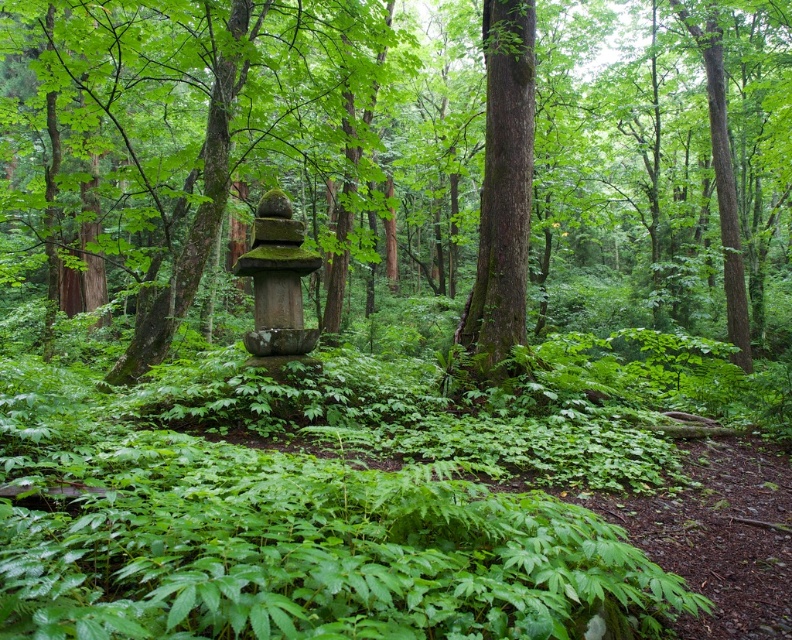
You are a hiker who wants to place a small backpack between the green mossy stone statue at center and the smooth brown tree trunk at center. Which object should you place the backpack closer to if you want it to be farther from the smaller object?

The green mossy stone statue at center is bigger than the smooth brown tree trunk at center. To place the backpack farther from the smaller object, which is the smooth brown tree trunk at center, you should position it closer to the green mossy stone statue at center.

You are a hiker who wants to take a photo of both the green mossy stone statue at center and the smooth brown tree trunk at center. Since you are standing in the forest, which object should you position to your left to include both in the frame?

The green mossy stone statue at center is to the right of the smooth brown tree trunk at center, so you should position the smooth brown tree trunk at center to your left to include both in the frame.